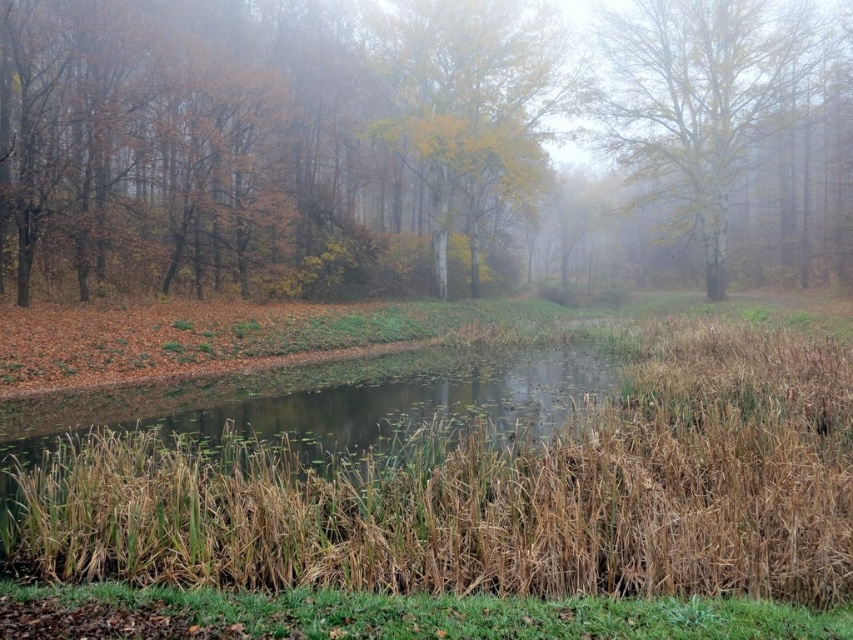
Who is higher up, yellow-green foliage at center or brown dry reed at center?

yellow-green foliage at center is higher up.

Which is below, yellow-green foliage at center or brown dry reed at center?

brown dry reed at center is below.

Does point (267, 76) come behind point (339, 577)?

Yes, point (267, 76) is farther from viewer.

Where is `yellow-green foliage at center`? This screenshot has height=640, width=853. yellow-green foliage at center is located at coordinates (409, 140).

Does yellow-green foliage at center appear over yellowish-brown bark tree at upper right?

No, yellow-green foliage at center is not above yellowish-brown bark tree at upper right.

Who is positioned more to the right, yellow-green foliage at center or yellowish-brown bark tree at upper right?

Positioned to the right is yellowish-brown bark tree at upper right.

At what (x,y) coordinates should I click in order to perform the action: click on yellow-green foliage at center. Please return your answer as a coordinate pair (x, y). This screenshot has height=640, width=853. Looking at the image, I should click on [x=409, y=140].

Which is below, brown dry reed at center or yellowish-brown bark tree at upper right?

brown dry reed at center is below.

Measure the distance between brown dry reed at center and yellowish-brown bark tree at upper right.

A distance of 35.64 meters exists between brown dry reed at center and yellowish-brown bark tree at upper right.

What are the coordinates of `brown dry reed at center` in the screenshot? It's located at (491, 496).

This screenshot has height=640, width=853. Identify the location of brown dry reed at center. (491, 496).